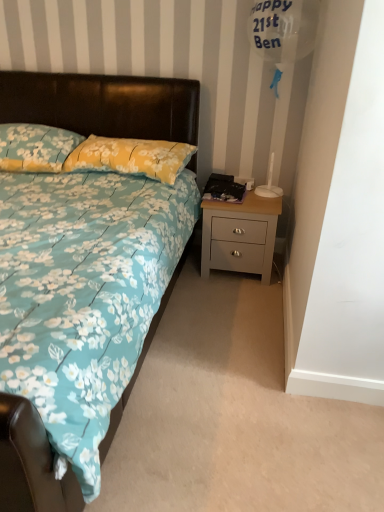
Question: Should I look upward or downward to see floral fabric bed at center?

Choices:
 (A) down
 (B) up

Answer: (B)

Question: From the image's perspective, would you say light gray wood nightstand at lower right is shown under floral fabric bed at center?

Choices:
 (A) no
 (B) yes

Answer: (B)

Question: Is the depth of light gray wood nightstand at lower right less than that of floral fabric bed at center?

Choices:
 (A) no
 (B) yes

Answer: (A)

Question: Is light gray wood nightstand at lower right located outside floral fabric bed at center?

Choices:
 (A) yes
 (B) no

Answer: (A)

Question: From a real-world perspective, is light gray wood nightstand at lower right below floral fabric bed at center?

Choices:
 (A) yes
 (B) no

Answer: (A)

Question: Is light gray wood nightstand at lower right facing towards floral fabric bed at center?

Choices:
 (A) yes
 (B) no

Answer: (B)

Question: Is light gray wood nightstand at lower right further to camera compared to floral fabric bed at center?

Choices:
 (A) no
 (B) yes

Answer: (B)

Question: From a real-world perspective, does light gray wood nightstand at lower right stand above yellow floral fabric pillow at center, marked as the 2th pillow in a left-to-right arrangement?

Choices:
 (A) yes
 (B) no

Answer: (B)

Question: Are light gray wood nightstand at lower right and yellow floral fabric pillow at center, the first pillow viewed from the right, making contact?

Choices:
 (A) no
 (B) yes

Answer: (A)

Question: Considering the relative sizes of light gray wood nightstand at lower right and yellow floral fabric pillow at center, marked as the 2th pillow in a left-to-right arrangement, in the image provided, is light gray wood nightstand at lower right shorter than yellow floral fabric pillow at center, marked as the 2th pillow in a left-to-right arrangement,?

Choices:
 (A) no
 (B) yes

Answer: (A)

Question: Could yellow floral fabric pillow at center, the first pillow viewed from the right, be considered to be inside light gray wood nightstand at lower right?

Choices:
 (A) no
 (B) yes

Answer: (A)

Question: Does light gray wood nightstand at lower right have a greater width compared to yellow floral fabric pillow at center, the first pillow viewed from the right?

Choices:
 (A) yes
 (B) no

Answer: (B)

Question: From a real-world perspective, is light gray wood nightstand at lower right under yellow floral fabric pillow at center, marked as the 2th pillow in a left-to-right arrangement?

Choices:
 (A) yes
 (B) no

Answer: (A)

Question: Is floral fabric bed at center not near yellow floral fabric pillow at center, the first pillow viewed from the right?

Choices:
 (A) no
 (B) yes

Answer: (A)